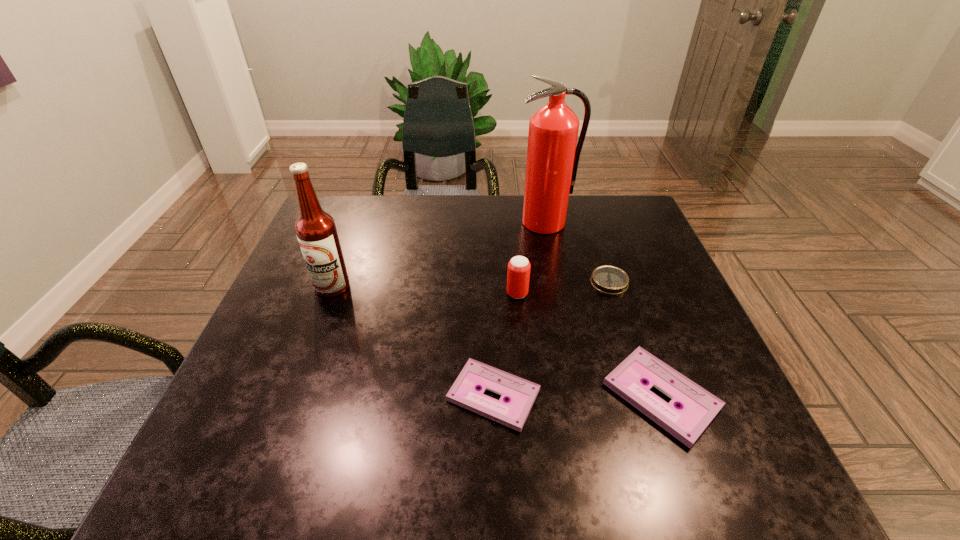
Locate an element on the screen. The height and width of the screenshot is (540, 960). free location located on the label side of the leftmost object is located at coordinates (306, 356).

At what (x,y) coordinates should I click in order to perform the action: click on free space located at the nozzle of the farthest object. Please return your answer as a coordinate pair (x, y). Image resolution: width=960 pixels, height=540 pixels. Looking at the image, I should click on (552, 258).

The height and width of the screenshot is (540, 960). I want to click on vacant space situated 0.310m on the back of the compass, so click(x=584, y=205).

Find the location of a particular element. This screenshot has height=540, width=960. vacant point located 0.090m on the left of the beer can is located at coordinates (468, 294).

Identify the location of object present at the far edge. (552, 155).

You are a GUI agent. You are given a task and a screenshot of the screen. Output one action in this format:
    pyautogui.click(x=<x>, y=<y>)
    Task: Click on the object that is at the left edge
    The height and width of the screenshot is (540, 960).
    Given the screenshot: What is the action you would take?
    pyautogui.click(x=316, y=232)

At what (x,y) coordinates should I click in order to perform the action: click on videotape positioned at the right edge. Please return your answer as a coordinate pair (x, y). This screenshot has height=540, width=960. Looking at the image, I should click on (697, 408).

Locate an element on the screen. Image resolution: width=960 pixels, height=540 pixels. compass located at the right edge is located at coordinates (612, 280).

Identify the location of object at the near right corner. This screenshot has height=540, width=960. (697, 408).

Locate an element on the screen. The width and height of the screenshot is (960, 540). vacant area at the far edge of the desktop is located at coordinates (462, 198).